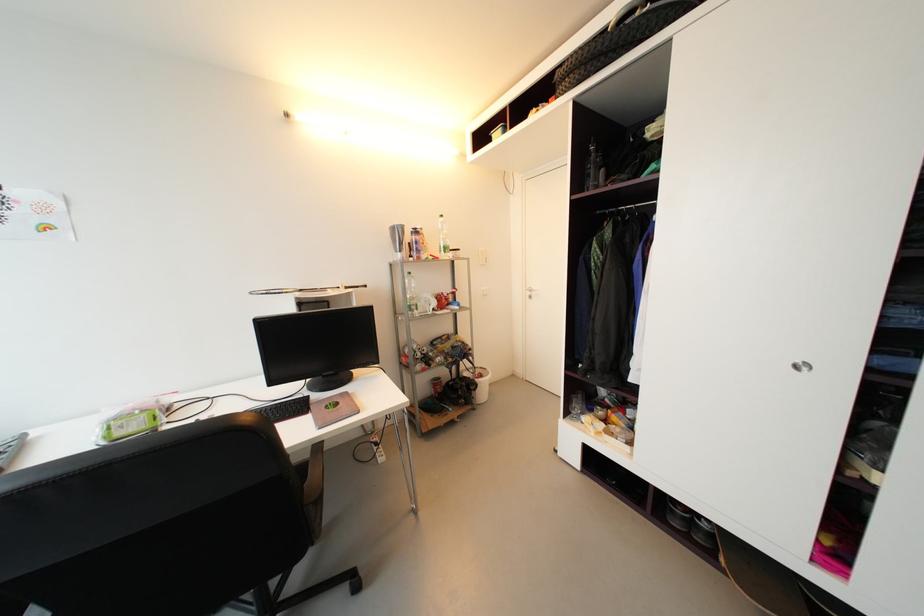
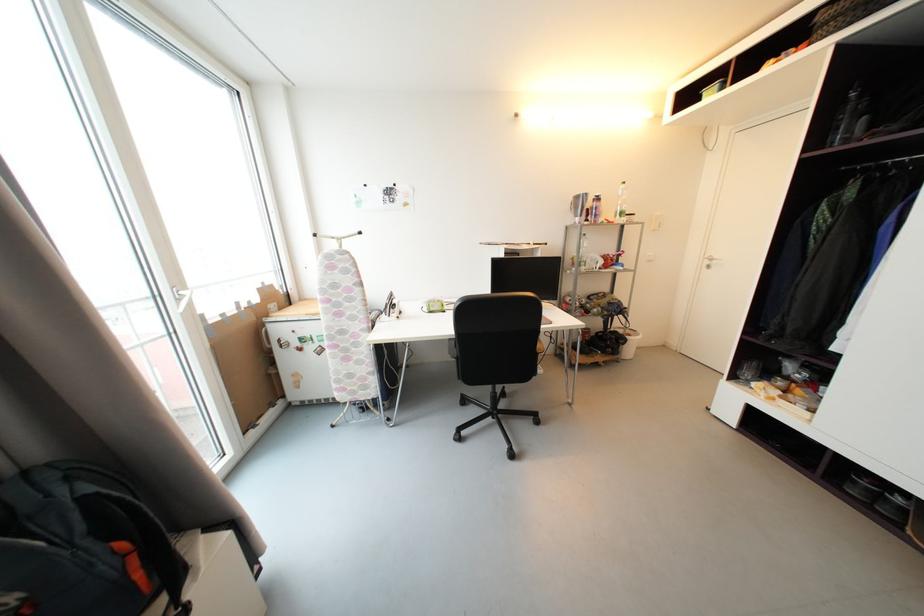
Question: The camera is either moving clockwise (left) or counter-clockwise (right) around the object. The first image is from the beginning of the video and the second image is from the end. Is the camera moving left or right when shooting the video?

Choices:
 (A) Left
 (B) Right

Answer: (B)